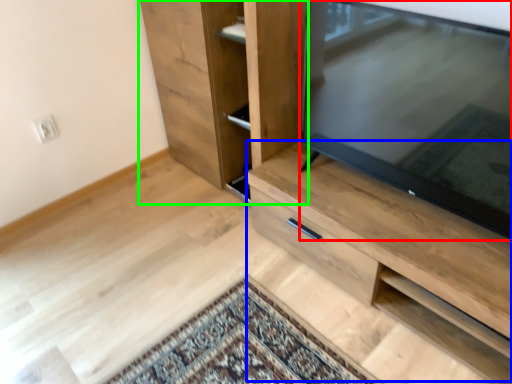
Question: Which object is the farthest from television (highlighted by a red box)? Choose among these: cabinetry (highlighted by a blue box) or cupboard (highlighted by a green box).

Choices:
 (A) cabinetry
 (B) cupboard

Answer: (B)